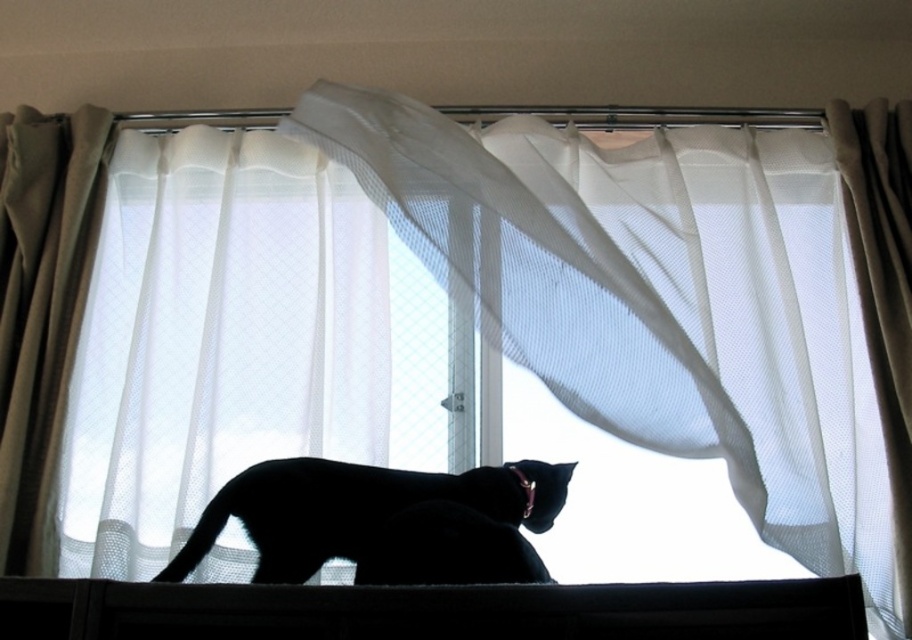
You are a photographer aiming to capture the black cat in the scene. You notice two points in the image labeled as point (16, 497) and point (401, 476). Which point is closer to your camera lens?

Point (16, 497) is further to the camera than point (401, 476), so the point closer to the camera lens is point (401, 476).

You are a photographer adjusting your camera settings to capture the black cat in the scene. You notice two points in the image labeled as point (169, 630) and point (17, 179). Which point should you focus on to ensure the cat is sharp in the foreground?

You should focus on point (169, 630) because it is closer to the viewer than point (17, 179), ensuring the cat in the foreground is sharp.

You are a delivery robot with a package that is 30 inches wide. You need to move through the space between the white sheer curtain at left and the black matte cat at center. Can your package fit through this space?

The distance between the white sheer curtain at left and the black matte cat at center is 25.34 inches. Since your package is 30 inches wide, it cannot fit through the space.